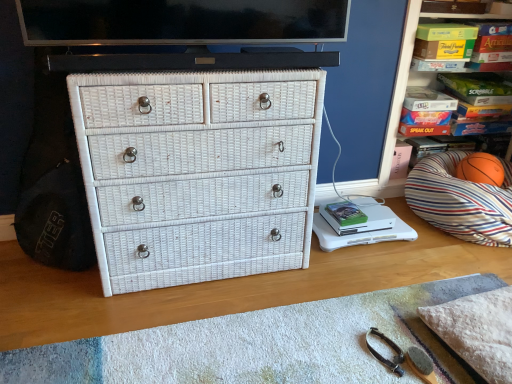
Find the location of a particular element. The image size is (512, 384). free space on the front side of white plastic changing table at lower right is located at coordinates (373, 273).